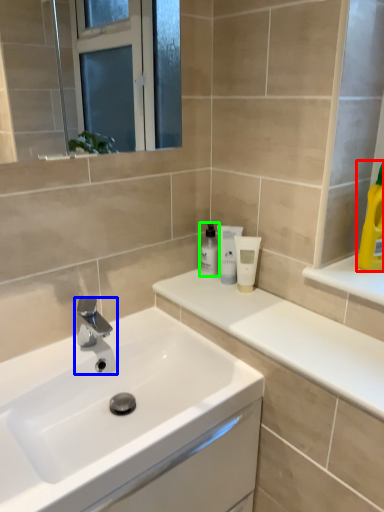
Question: Which is nearer to the cleaning product (highlighted by a red box)? tap (highlighted by a blue box) or mouthwash (highlighted by a green box).

Choices:
 (A) tap
 (B) mouthwash

Answer: (B)